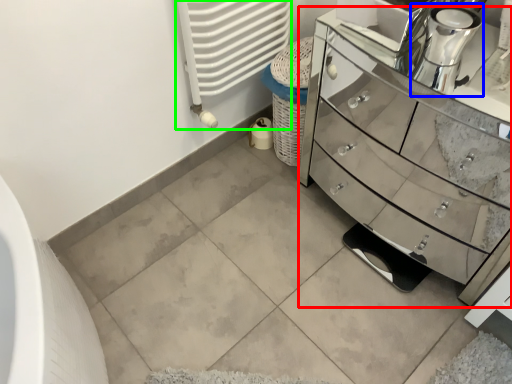
Question: Estimate the real-world distances between objects in this image. Which object is closer to chest of drawers (highlighted by a red box), coffee machine (highlighted by a blue box) or radiator (highlighted by a green box)?

Choices:
 (A) coffee machine
 (B) radiator

Answer: (B)